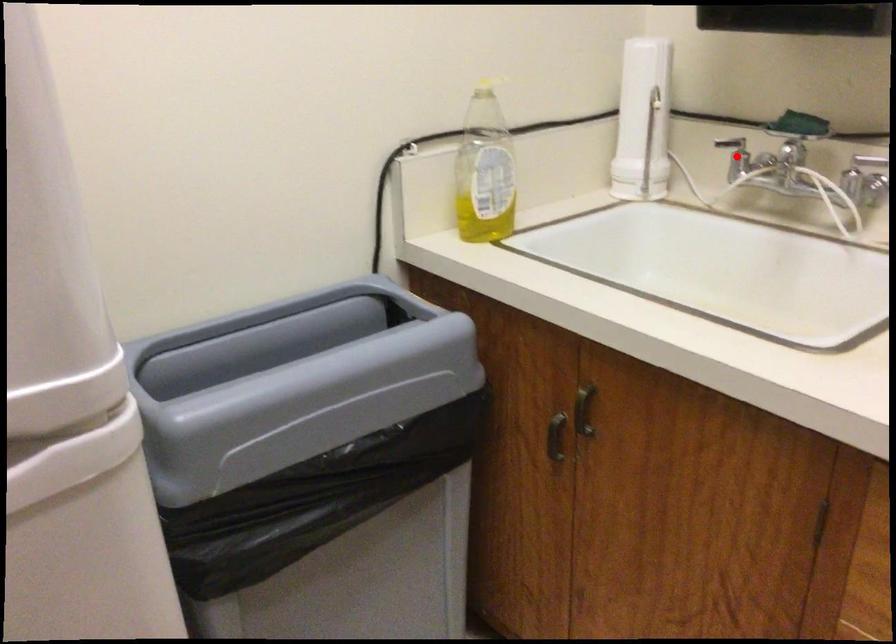
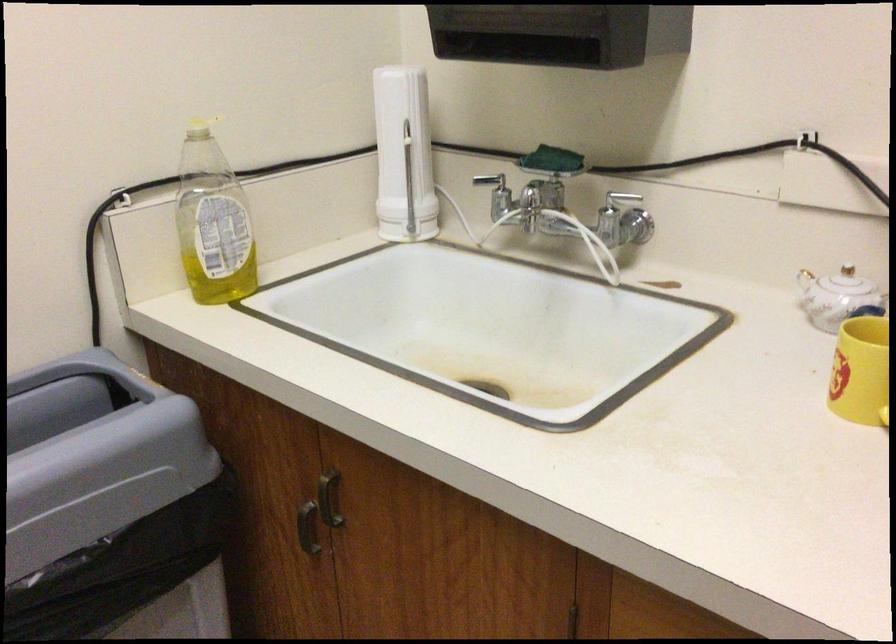
Question: I am providing you with two images of the same scene from different viewpoints. A red point is marked on the first image. Is the red point's position out of view in image 2?

Choices:
 (A) Yes
 (B) No

Answer: (B)